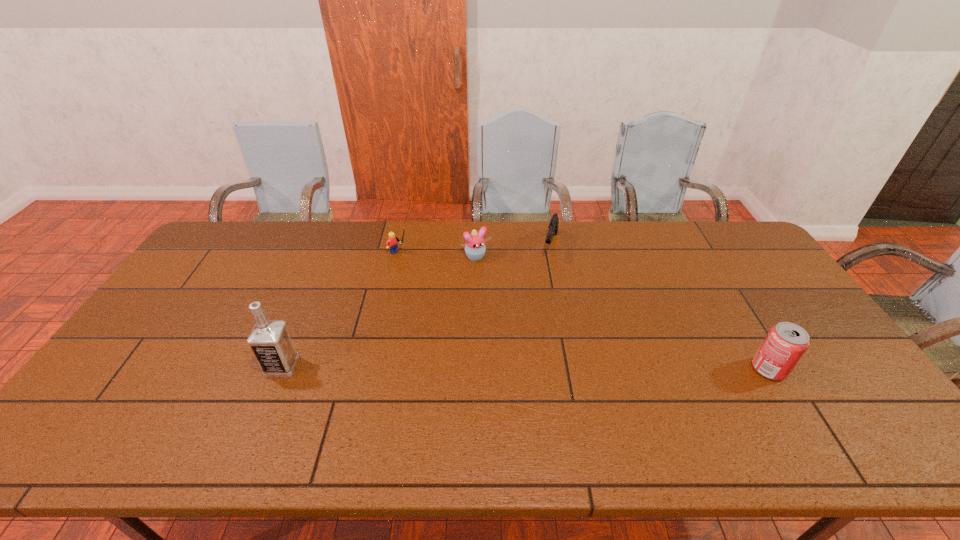
This screenshot has height=540, width=960. I want to click on gun that is at the far edge, so click(553, 225).

In order to click on Lego that is positioned at the far edge in this screenshot , I will do `click(391, 243)`.

The height and width of the screenshot is (540, 960). I want to click on cupcake present at the far edge, so click(x=475, y=248).

Locate an element on the screen. The height and width of the screenshot is (540, 960). object situated at the right edge is located at coordinates (785, 343).

You are a GUI agent. You are given a task and a screenshot of the screen. Output one action in this format:
    pyautogui.click(x=<x>, y=<y>)
    Task: Click on the free space at the far edge
    Image resolution: width=960 pixels, height=540 pixels.
    Given the screenshot: What is the action you would take?
    pyautogui.click(x=389, y=221)

The image size is (960, 540). Identify the location of blank space at the near edge of the desktop. (612, 404).

This screenshot has height=540, width=960. In order to click on vacant space at the left edge in this screenshot , I will do `click(121, 376)`.

Identify the location of blank space at the right edge of the desktop. (793, 374).

The width and height of the screenshot is (960, 540). In the image, there is a desktop. In order to click on free region at the far left corner in this screenshot , I will do [x=249, y=230].

This screenshot has width=960, height=540. In order to click on free space at the near left corner of the desktop in this screenshot , I will do `click(132, 408)`.